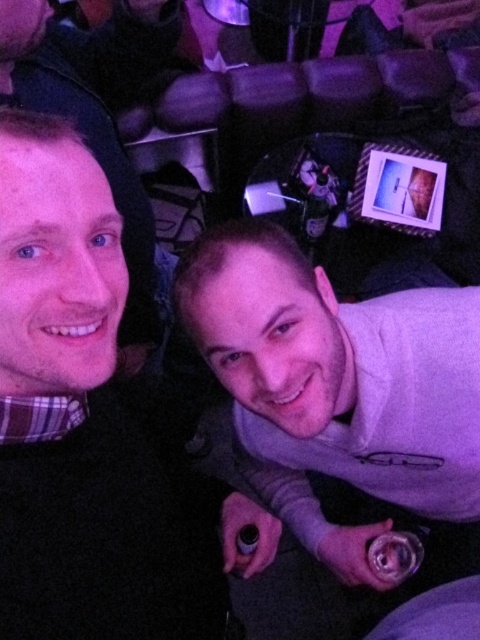
You are at a party and want to grab a drink from the table behind the two people. The table has a matte black sweater at left and a gray fleece sweater at center. Which sweater should you avoid moving to reach the drinks without disturbing anyone?

You should avoid moving the matte black sweater at left because it is below the gray fleece sweater at center, meaning it is closer to you and moving it might disturb the person wearing it.

You are at the point labeled as point [0,195]. You want to walk towards the point labeled as point [458,416]. Which direction should you move relative to the two points?

You should move towards the point [458,416], which is behind point [0,195] in the scene. Since point [0,195] is in front of point [458,416], you need to move backward or away from the current position to reach the target point.